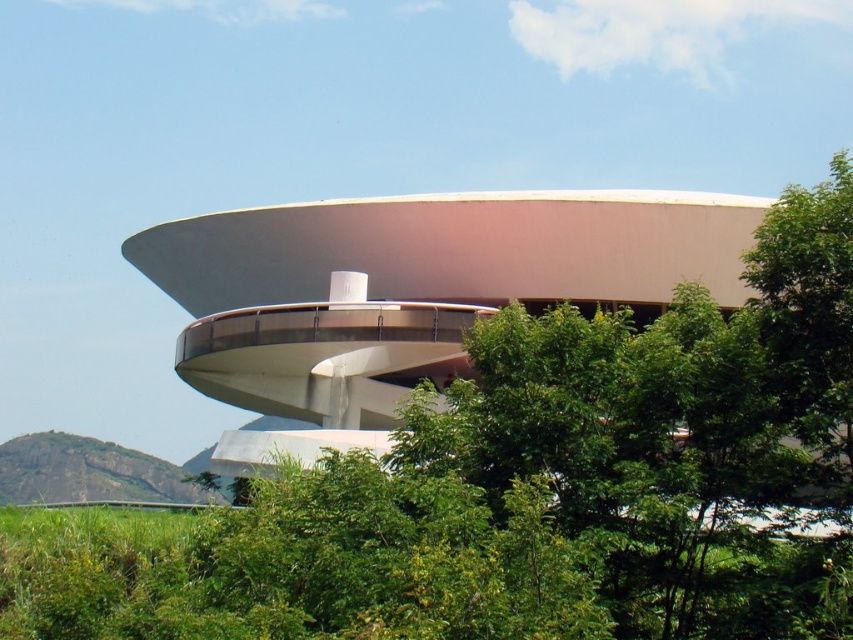
Question: Estimate the real-world distances between objects in this image. Which object is farther from the white smooth building at center?

Choices:
 (A) rugged rock at lower left
 (B) green leafy tree at right

Answer: (A)

Question: Is the position of white smooth building at center less distant than that of rugged rock at lower left?

Choices:
 (A) yes
 (B) no

Answer: (A)

Question: From the image, what is the correct spatial relationship of green leafy tree at right in relation to rugged rock at lower left?

Choices:
 (A) left
 (B) right

Answer: (B)

Question: Estimate the real-world distances between objects in this image. Which object is closer to the rugged rock at lower left?

Choices:
 (A) green leafy tree at right
 (B) white smooth building at center

Answer: (B)

Question: Where is white smooth building at center located in relation to rugged rock at lower left in the image?

Choices:
 (A) left
 (B) right

Answer: (B)

Question: Which object is closer to the camera taking this photo?

Choices:
 (A) green leafy tree at right
 (B) rugged rock at lower left
 (C) white smooth building at center

Answer: (A)